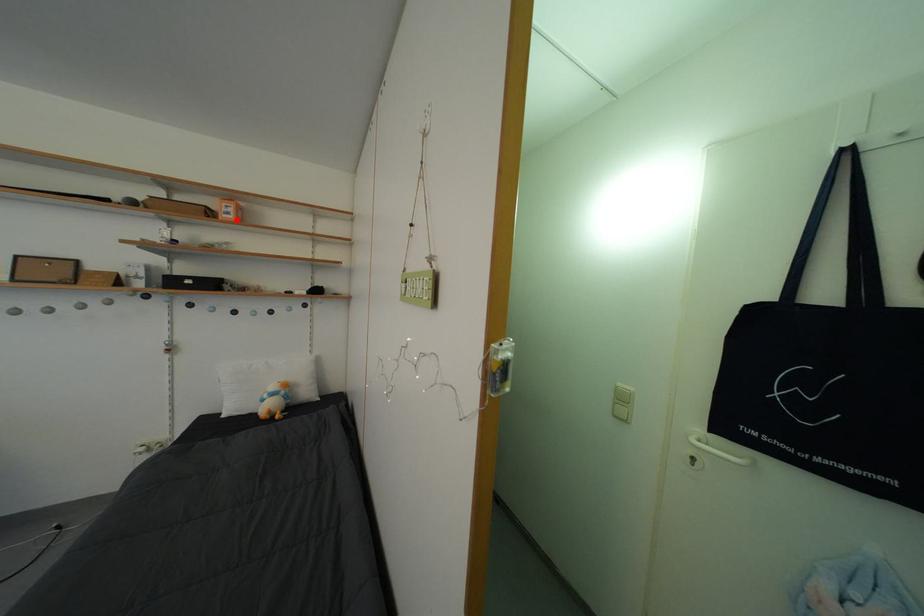
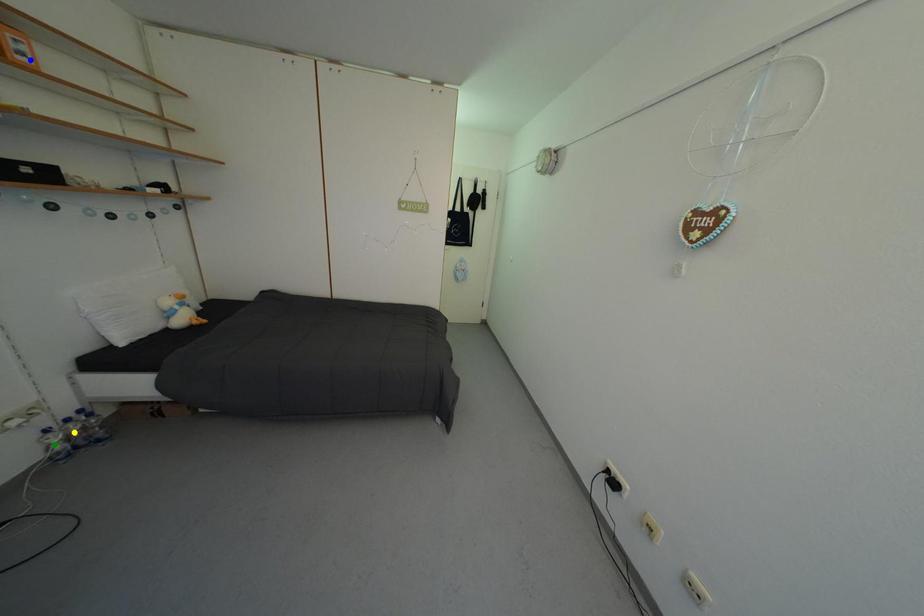
Question: I am providing you with two images of the same scene from different viewpoints. A red point is marked on the first image. You are given multiple points on the second image. Which point in image 2 is actually the same real-world point as the red point in image 1?

Choices:
 (A) green point
 (B) yellow point
 (C) blue point

Answer: (C)